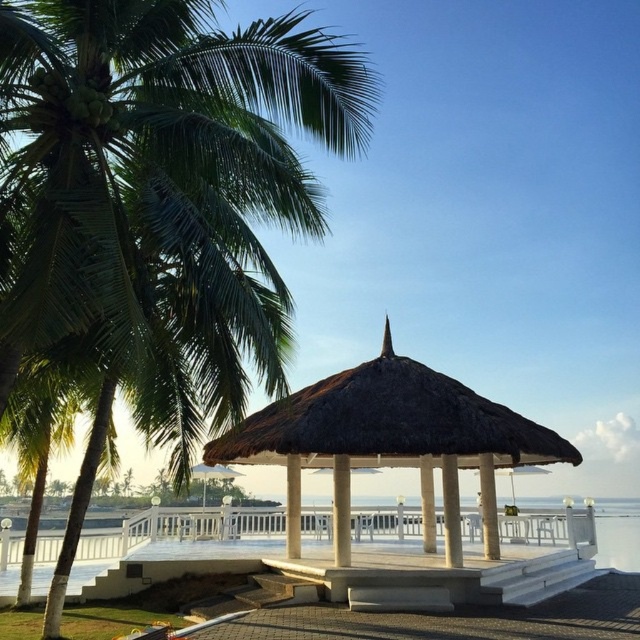
You are standing at the entrance of the thatched pavilion and want to take a photo of two points in the scene. The first point is at coordinates point (227, 134) and the second is at point (228, 461). Which point will appear larger in your photo?

Point (227, 134) will appear larger in the photo because it is closer to the camera than point (228, 461).

In the scene shown: You are standing at the entrance of the thatched wood gazebo at center and want to take a photo of the green leafy palm tree at left. Which direction should you face to capture the palm tree in your shot?

You should face to the left to capture the green leafy palm tree at left in your shot because it is positioned over the thatched wood gazebo at center.

You are a visitor at the beach and want to take a photo of the thatched wood gazebo at center with the green leafy palm tree at left in the background. Will the palm tree be fully visible in the photo if you stand at the base of the palm tree?

The green leafy palm tree at left is taller than the thatched wood gazebo at center, so if you stand at the base of the palm tree, the top of the palm tree will block part of the gazebo, making it impossible to capture the entire thatched wood gazebo at center in the photo.